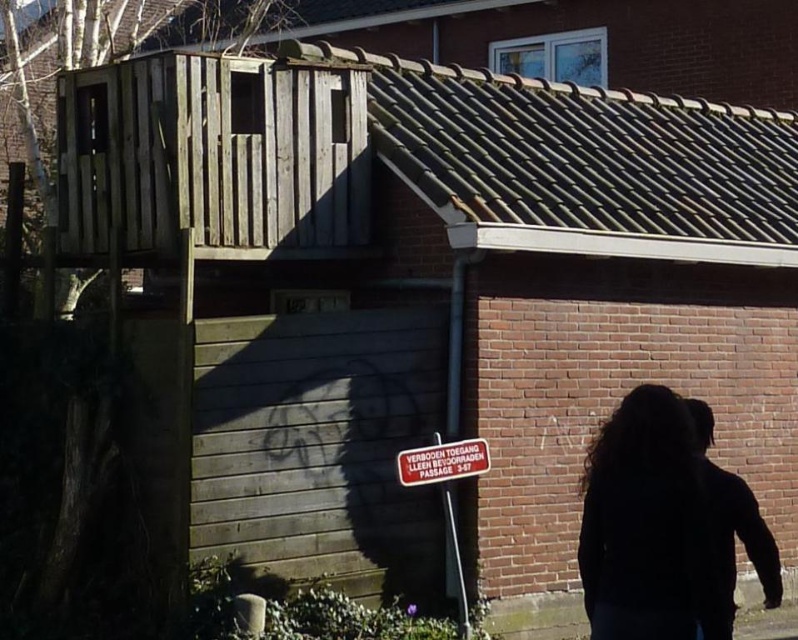
You are a delivery person trying to locate the apartment number on the building. You see the black matte hair at lower right and the metallic reflective sign at center. Which object is bigger and might help you see the apartment number from a distance?

The black matte hair at lower right is larger in size than the metallic reflective sign at center, so it might be easier to see from a distance.

You are a delivery person standing at the entrance of the brick building. You need to deliver a package to the address located at the metallic reflective sign at center. The package is too large to carry while climbing the stairs. There is a black matte hair at lower right that belongs to a resident. Can you ask them for help, and will they be within shouting distance?

The black matte hair at lower right is 2.54 meters away from the metallic reflective sign at center. Since the distance between them is less than 10 meters, the resident with the black matte hair at lower right is within shouting distance and can assist with the package delivery.